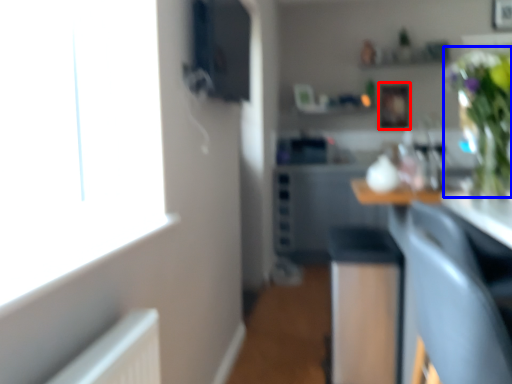
Question: Among these objects, which one is farthest to the camera, picture frame (highlighted by a red box) or floral arrangement (highlighted by a blue box)?

Choices:
 (A) picture frame
 (B) floral arrangement

Answer: (A)